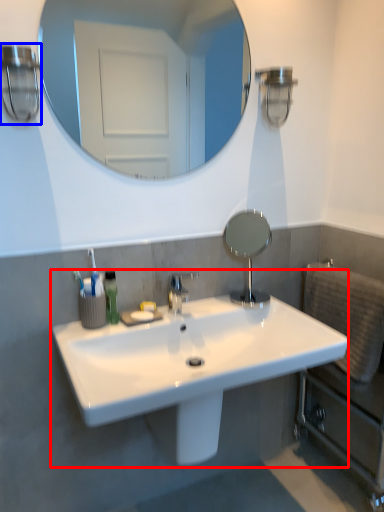
Question: Which of the following is the farthest to the observer, sink (highlighted by a red box) or light fixture (highlighted by a blue box)?

Choices:
 (A) sink
 (B) light fixture

Answer: (B)